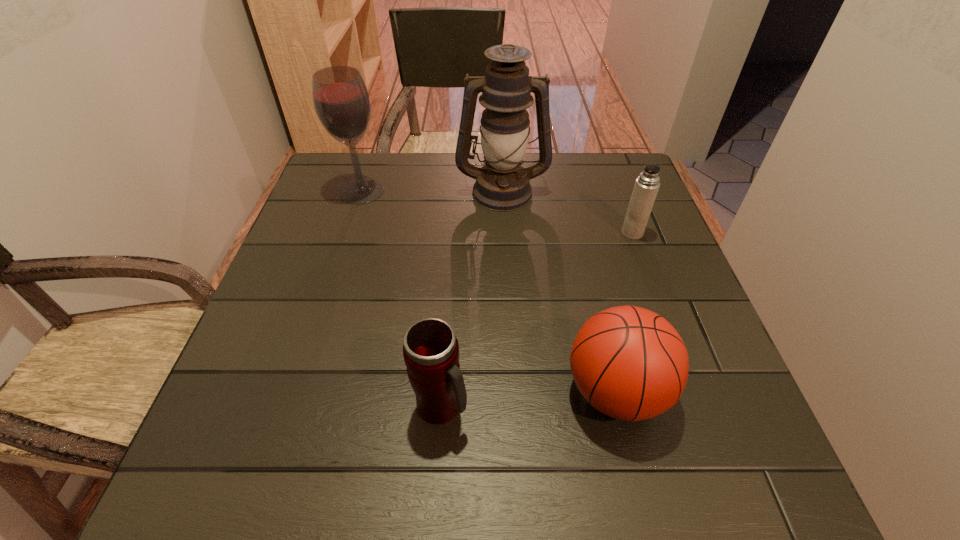
Find the location of `free region located 0.070m on the left of the right thermos bottle`. free region located 0.070m on the left of the right thermos bottle is located at coordinates (593, 233).

Where is `free point located 0.070m on the left of the basketball`? free point located 0.070m on the left of the basketball is located at coordinates (524, 392).

In order to click on oil lamp that is at the far edge in this screenshot , I will do `click(502, 184)`.

Where is `alcohol that is at the far edge`? The image size is (960, 540). alcohol that is at the far edge is located at coordinates (341, 100).

Locate an element on the screen. This screenshot has height=540, width=960. object at the left edge is located at coordinates (341, 100).

The height and width of the screenshot is (540, 960). I want to click on thermos bottle situated at the right edge, so click(x=646, y=187).

This screenshot has width=960, height=540. I want to click on basketball at the right edge, so click(x=629, y=363).

At what (x,y) coordinates should I click in order to perform the action: click on object positioned at the far left corner. Please return your answer as a coordinate pair (x, y). The height and width of the screenshot is (540, 960). Looking at the image, I should click on (341, 100).

You are a GUI agent. You are given a task and a screenshot of the screen. Output one action in this format:
    pyautogui.click(x=<x>, y=<y>)
    Task: Click on the free spot at the far edge of the desktop
    
    Given the screenshot: What is the action you would take?
    pyautogui.click(x=457, y=180)

Find the location of `blank space at the near edge of the desktop`. blank space at the near edge of the desktop is located at coordinates (540, 453).